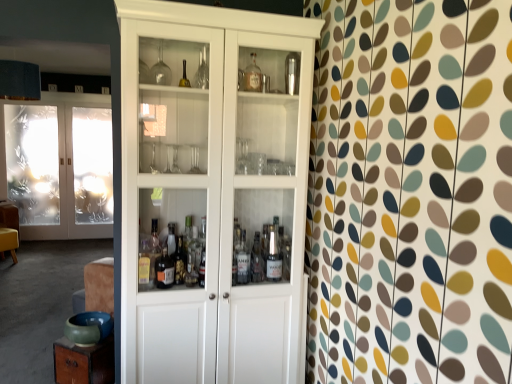
Locate an element on the screen. Image resolution: width=512 pixels, height=384 pixels. white wood cabinet at center is located at coordinates 214,190.

The image size is (512, 384). What are the coordinates of `transparent plastic screen door at left` in the screenshot? It's located at (92, 168).

What do you see at coordinates (92, 168) in the screenshot? This screenshot has height=384, width=512. I see `transparent plastic screen door at left` at bounding box center [92, 168].

Locate an element on the screen. white wood cabinet at center is located at coordinates (214, 190).

Is transparent plastic screen door at left not within white wood cabinet at center?

Indeed, transparent plastic screen door at left is completely outside white wood cabinet at center.

Can you confirm if transparent plastic screen door at left is bigger than white wood cabinet at center?

Incorrect, transparent plastic screen door at left is not larger than white wood cabinet at center.

Consider the image. Does transparent plastic screen door at left have a lesser width compared to white wood cabinet at center?

Yes, transparent plastic screen door at left is thinner than white wood cabinet at center.

Is transparent plastic screen door at left next to white wood cabinet at center and touching it?

No.

I want to click on door located on the left of transparent plastic screen door at left, so click(x=59, y=165).

Which is less distant, (25, 198) or (101, 194)?

Point (25, 198)

Based on the photo, considering the relative sizes of frosted glass doors at left and transparent plastic screen door at left in the image provided, is frosted glass doors at left thinner than transparent plastic screen door at left?

No, frosted glass doors at left is not thinner than transparent plastic screen door at left.

From the image's perspective, is frosted glass doors at left located above or below white wood cabinet at center?

Based on their image positions, frosted glass doors at left is located above white wood cabinet at center.

Is frosted glass doors at left not inside white wood cabinet at center?

Yes.

Considering the relative sizes of frosted glass doors at left and white wood cabinet at center in the image provided, is frosted glass doors at left thinner than white wood cabinet at center?

Correct, the width of frosted glass doors at left is less than that of white wood cabinet at center.

Image resolution: width=512 pixels, height=384 pixels. I want to click on screen door that is above the frosted glass doors at left (from a real-world perspective), so click(x=92, y=168).

Between point (93, 184) and point (84, 135), which one is positioned behind?

The point (93, 184) is behind.

Visually, is transparent plastic screen door at left positioned to the left or to the right of frosted glass doors at left?

transparent plastic screen door at left is to the right of frosted glass doors at left.

Do you think white wood cabinet at center is within frosted glass doors at left, or outside of it?

white wood cabinet at center is outside frosted glass doors at left.

From the image's perspective, which one is positioned higher, white wood cabinet at center or frosted glass doors at left?

frosted glass doors at left.

Considering the relative positions of white wood cabinet at center and frosted glass doors at left in the image provided, is white wood cabinet at center to the right of frosted glass doors at left from the viewer's perspective?

Indeed, white wood cabinet at center is positioned on the right side of frosted glass doors at left.

Is white wood cabinet at center behind frosted glass doors at left?

No, the depth of white wood cabinet at center is less than that of frosted glass doors at left.

Is white wood cabinet at center oriented towards transparent plastic screen door at left?

No.

Is point (296, 373) in front of point (109, 181)?

Yes, it is in front of point (109, 181).

Image resolution: width=512 pixels, height=384 pixels. What are the coordinates of `cupboard that appears in front of the transparent plastic screen door at left` in the screenshot? It's located at (214, 190).

This screenshot has height=384, width=512. I want to click on screen door that appears behind the white wood cabinet at center, so click(92, 168).

Locate an element on the screen. Image resolution: width=512 pixels, height=384 pixels. door below the transparent plastic screen door at left (from the image's perspective) is located at coordinates (59, 165).

Considering their positions, is transparent plastic screen door at left positioned further to frosted glass doors at left than white wood cabinet at center?

white wood cabinet at center.

Considering their positions, is transparent plastic screen door at left positioned further to white wood cabinet at center than frosted glass doors at left?

frosted glass doors at left.

From the image, which object appears to be nearer to white wood cabinet at center, frosted glass doors at left or transparent plastic screen door at left?

transparent plastic screen door at left is closer to white wood cabinet at center.

Based on their spatial positions, is frosted glass doors at left or white wood cabinet at center further from transparent plastic screen door at left?

white wood cabinet at center is further to transparent plastic screen door at left.

Based on the photo, which object lies further to the anchor point frosted glass doors at left, white wood cabinet at center or transparent plastic screen door at left?

Among the two, white wood cabinet at center is located further to frosted glass doors at left.

When comparing their distances from transparent plastic screen door at left, does white wood cabinet at center or frosted glass doors at left seem closer?

frosted glass doors at left lies closer to transparent plastic screen door at left than the other object.

Find the location of a particular element. The width and height of the screenshot is (512, 384). door between white wood cabinet at center and transparent plastic screen door at left from front to back is located at coordinates (59, 165).